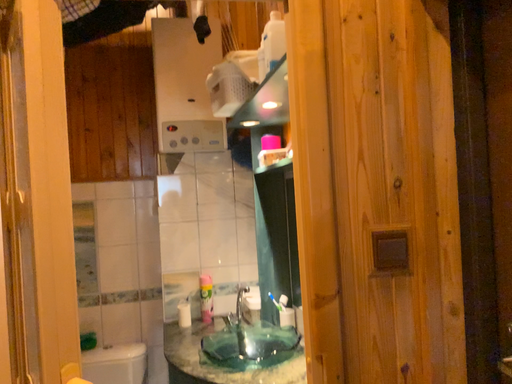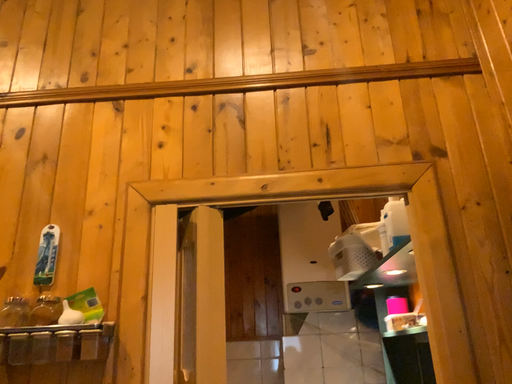
Question: Which way did the camera rotate in the video?

Choices:
 (A) rotated upward
 (B) rotated downward

Answer: (A)